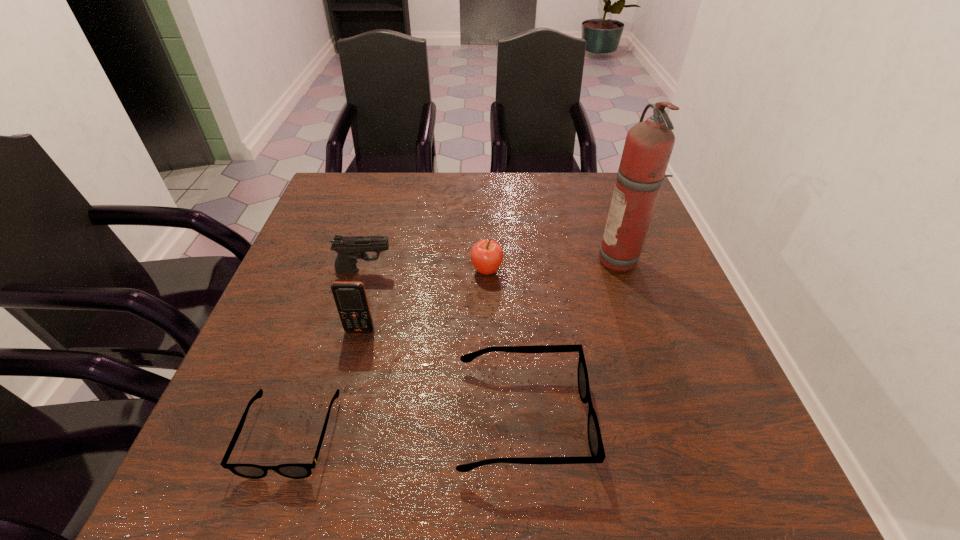
Locate an element on the screen. The image size is (960, 540). the shorter spectacles is located at coordinates (295, 471).

This screenshot has width=960, height=540. Identify the location of the left spectacles. (295, 471).

Identify the location of the right spectacles. The width and height of the screenshot is (960, 540). (595, 441).

At what (x,y) coordinates should I click in order to perform the action: click on the taller spectacles. Please return your answer as a coordinate pair (x, y). The height and width of the screenshot is (540, 960). Looking at the image, I should click on (595, 441).

Where is `pistol`? pistol is located at coordinates (349, 248).

This screenshot has height=540, width=960. I want to click on fire extinguisher, so click(x=648, y=146).

This screenshot has height=540, width=960. In order to click on the tallest object in this screenshot , I will do `click(648, 146)`.

You are a GUI agent. You are given a task and a screenshot of the screen. Output one action in this format:
    pyautogui.click(x=<x>, y=<y>)
    Task: Click on the apple
    This screenshot has width=960, height=540.
    Given the screenshot: What is the action you would take?
    pyautogui.click(x=486, y=255)

I want to click on the fifth shortest object, so click(x=351, y=300).

The width and height of the screenshot is (960, 540). I want to click on cellular telephone, so click(x=351, y=300).